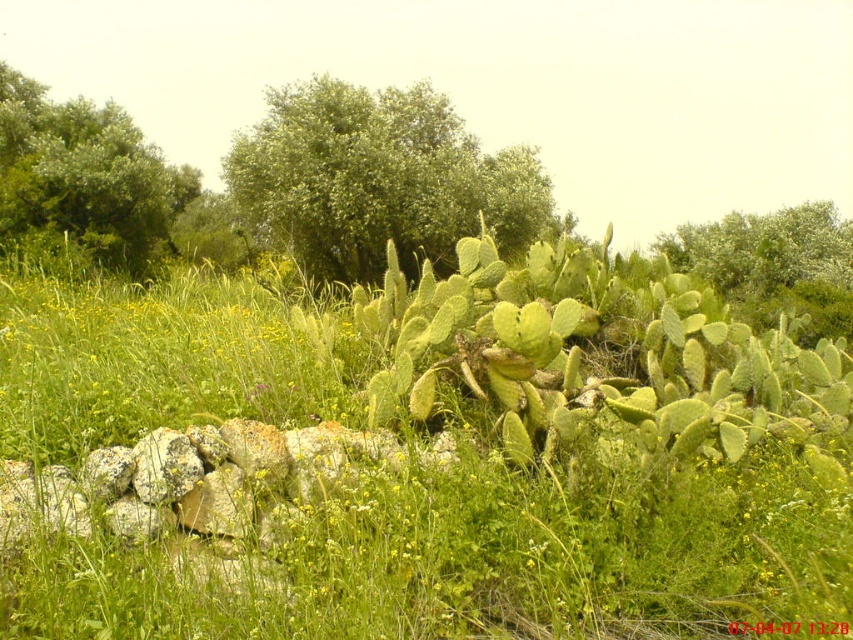
Question: Can you confirm if green leafy tree at center is positioned to the left of green leafy tree at upper left?

Choices:
 (A) no
 (B) yes

Answer: (A)

Question: Among these objects, which one is nearest to the camera?

Choices:
 (A) green leafy tree at upper center
 (B) green leafy tree at upper left

Answer: (B)

Question: Which of the following is the closest to the observer?

Choices:
 (A) (73, 140)
 (B) (392, 92)

Answer: (A)

Question: Is green leafy tree at upper left further to camera compared to green leafy tree at upper center?

Choices:
 (A) yes
 (B) no

Answer: (B)

Question: Is green leafy tree at center positioned behind green leafy tree at upper left?

Choices:
 (A) yes
 (B) no

Answer: (A)

Question: Among these points, which one is farthest from the camera?

Choices:
 (A) (277, 88)
 (B) (791, 280)
 (C) (100, 248)

Answer: (A)